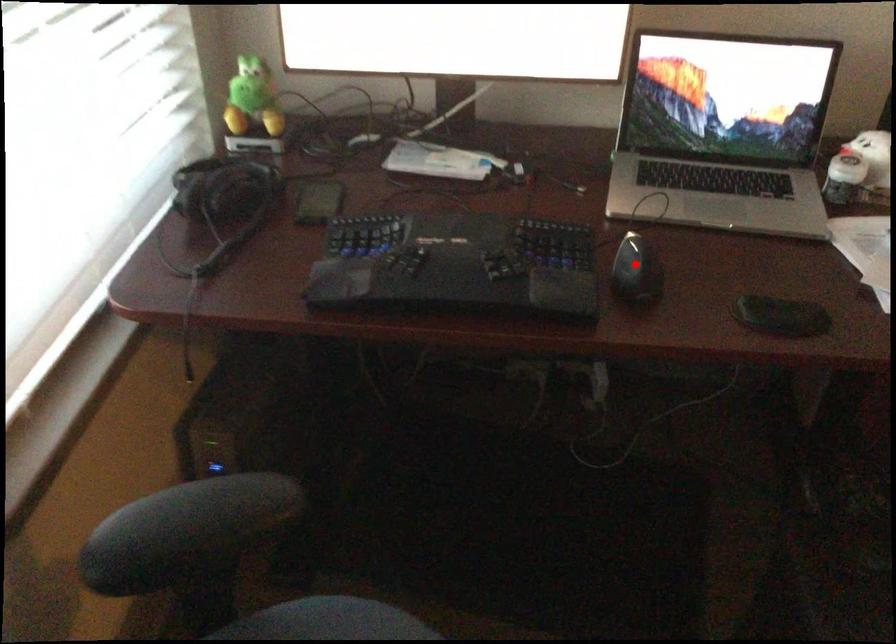
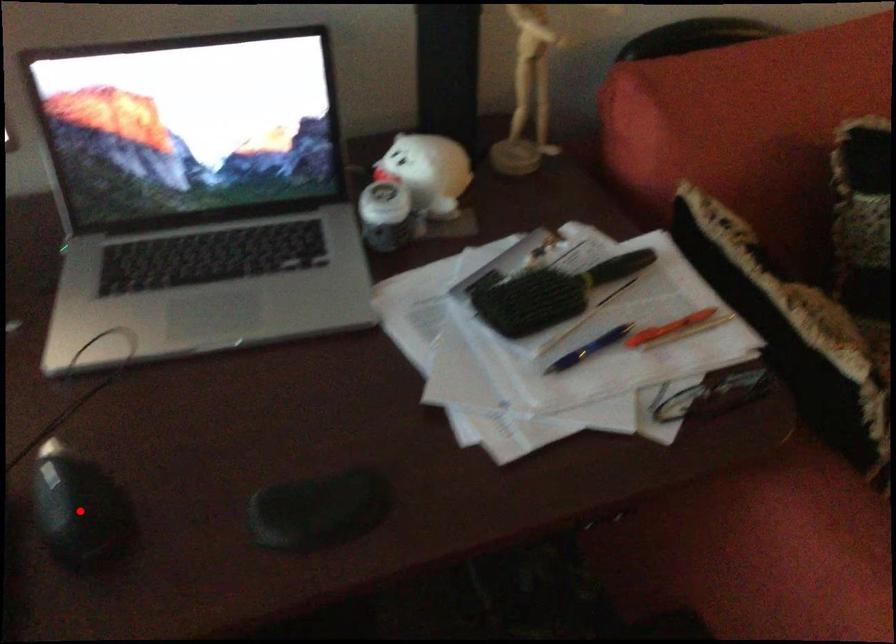
I am providing you with two images of the same scene from different viewpoints. A red point is marked on the first image and another point is marked on the second image. Are the points marked in image1 and image2 representing the same 3D position?

Yes